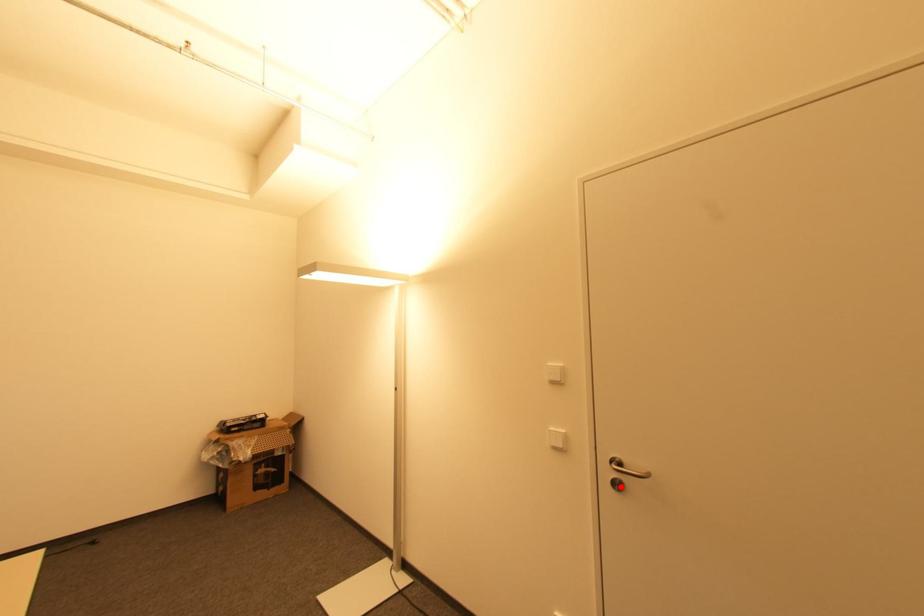
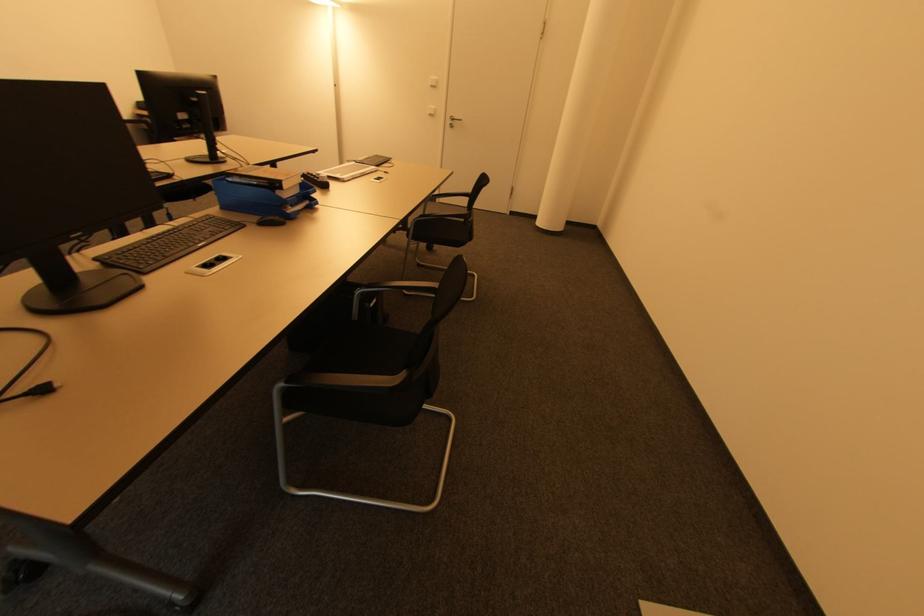
In the second image, find the point that corresponds to the highlighted location in the first image.

(454, 127)